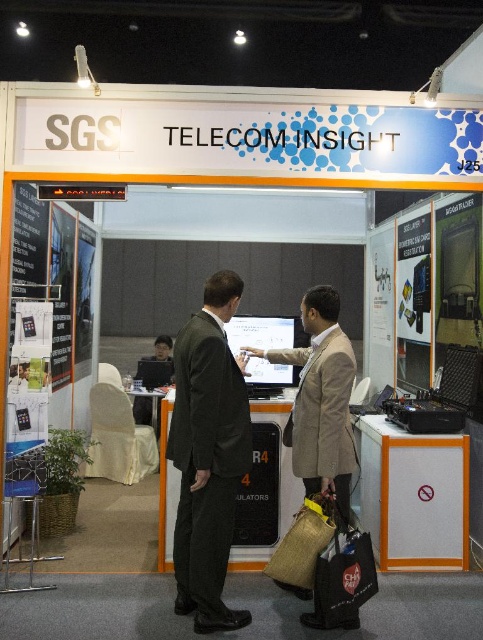
Question: Which point is closer to the camera?

Choices:
 (A) (380, 420)
 (B) (228, 544)

Answer: (B)

Question: Does dark green fabric business suit at center lie behind beige textured blazer at center?

Choices:
 (A) yes
 (B) no

Answer: (B)

Question: Is dark green fabric business suit at center thinner than beige textured blazer at center?

Choices:
 (A) yes
 (B) no

Answer: (A)

Question: Estimate the real-world distances between objects in this image. Which object is farther from the beige textured blazer at center?

Choices:
 (A) dark green fabric business suit at center
 (B) orange plastic cabinet at lower right

Answer: (B)

Question: Is dark green fabric business suit at center to the right of orange plastic cabinet at lower right from the viewer's perspective?

Choices:
 (A) yes
 (B) no

Answer: (B)

Question: Which object is closer to the camera taking this photo?

Choices:
 (A) dark green fabric business suit at center
 (B) beige textured blazer at center
 (C) orange plastic cabinet at lower right

Answer: (A)